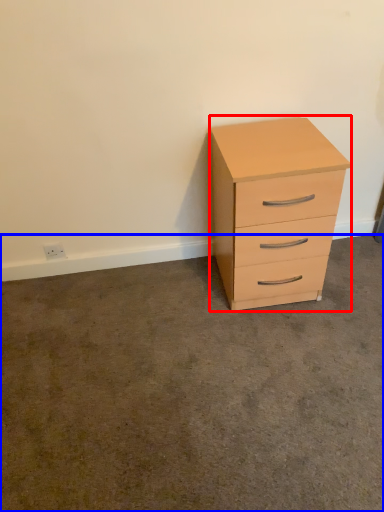
Question: Among these objects, which one is farthest to the camera, chest of drawers (highlighted by a red box) or concrete (highlighted by a blue box)?

Choices:
 (A) chest of drawers
 (B) concrete

Answer: (A)